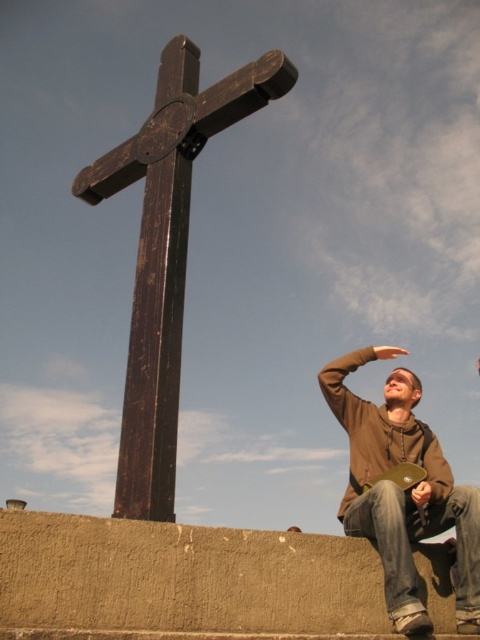
Is dark wood cross at center below brown hoodie at lower right?

No, dark wood cross at center is not below brown hoodie at lower right.

Does dark wood cross at center appear on the right side of brown hoodie at lower right?

Incorrect, dark wood cross at center is not on the right side of brown hoodie at lower right.

Does point (163, 145) come closer to viewer compared to point (430, 490)?

No, it is not.

Find the location of a particular element. dark wood cross at center is located at coordinates (167, 252).